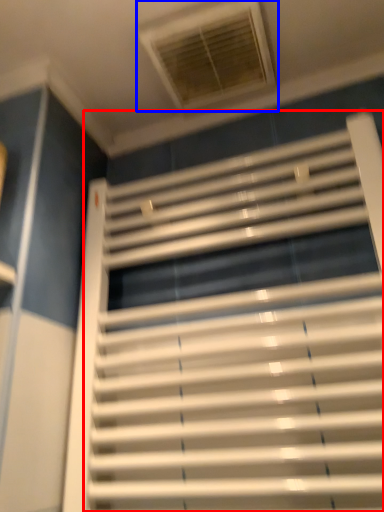
Question: Among these objects, which one is farthest to the camera, window blind (highlighted by a red box) or window (highlighted by a blue box)?

Choices:
 (A) window blind
 (B) window

Answer: (B)